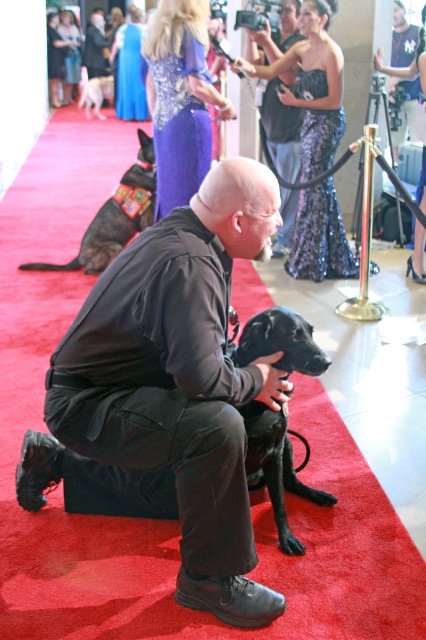
Which is in front, point (224, 397) or point (285, 218)?

Positioned in front is point (224, 397).

Between black matte jacket at center and matte black shirt at center, which one appears on the right side from the viewer's perspective?

Positioned to the right is matte black shirt at center.

The image size is (426, 640). What do you see at coordinates (180, 380) in the screenshot? I see `black matte jacket at center` at bounding box center [180, 380].

I want to click on black matte jacket at center, so click(180, 380).

Does matte black shirt at center have a greater width compared to white fur dog at upper left?

Incorrect, matte black shirt at center's width does not surpass white fur dog at upper left's.

Who is shorter, matte black shirt at center or white fur dog at upper left?

white fur dog at upper left

Which is in front, point (264, 54) or point (94, 77)?

Point (264, 54) is in front.

Where is `matte black shirt at center`? matte black shirt at center is located at coordinates (282, 128).

Can you confirm if black matte jacket at center is bigger than matte black jacket at center?

No, black matte jacket at center is not bigger than matte black jacket at center.

Is point (134, 419) positioned in front of point (405, 24)?

Yes.

Locate an element on the screen. black matte jacket at center is located at coordinates (180, 380).